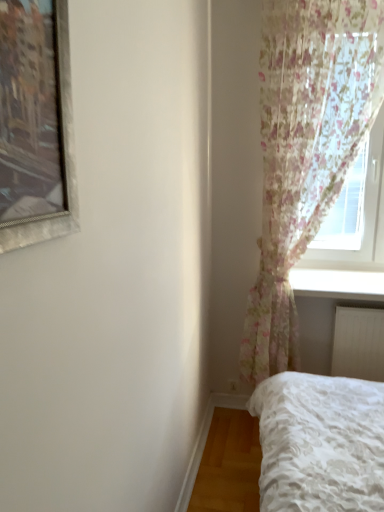
Find the location of a particular element. The image size is (384, 512). free space above white glossy window sill at lower right (from a real-world perspective) is located at coordinates (339, 277).